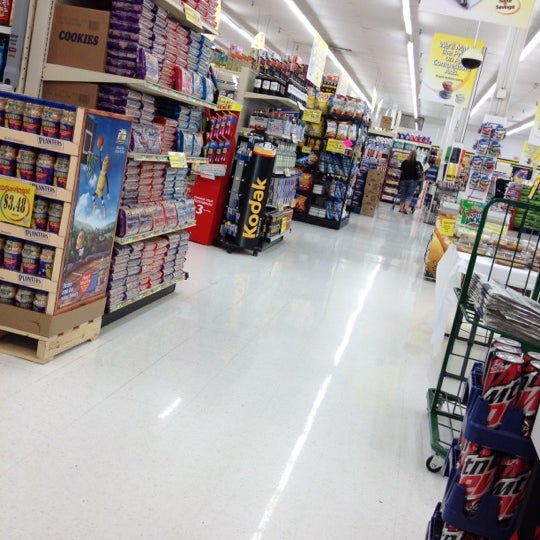
This screenshot has height=540, width=540. What are the coordinates of `wall` in the screenshot? It's located at (436, 127), (512, 144).